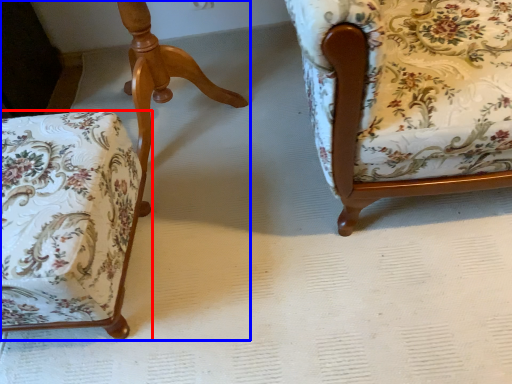
Question: Which object is closer to the camera taking this photo, chair (highlighted by a red box) or chair (highlighted by a blue box)?

Choices:
 (A) chair
 (B) chair

Answer: (A)